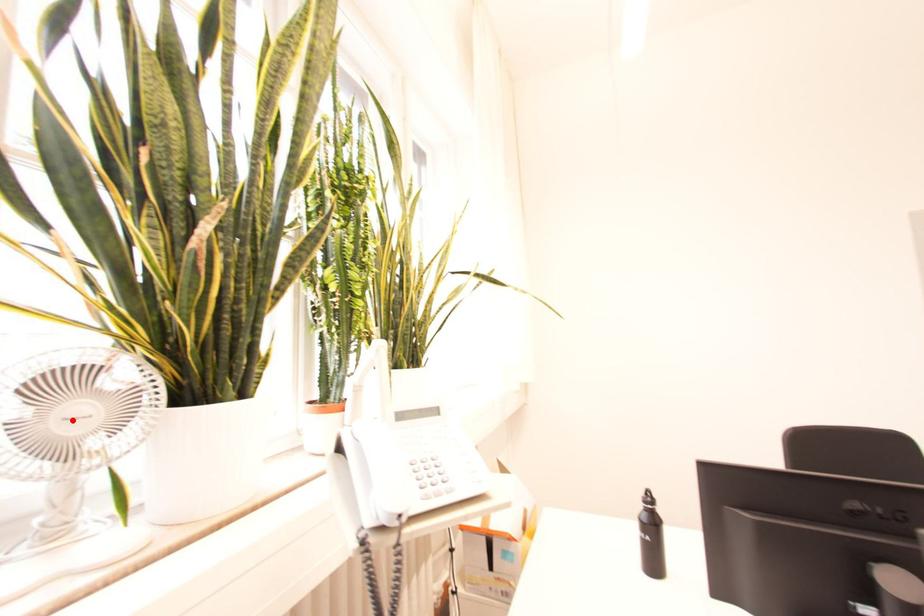
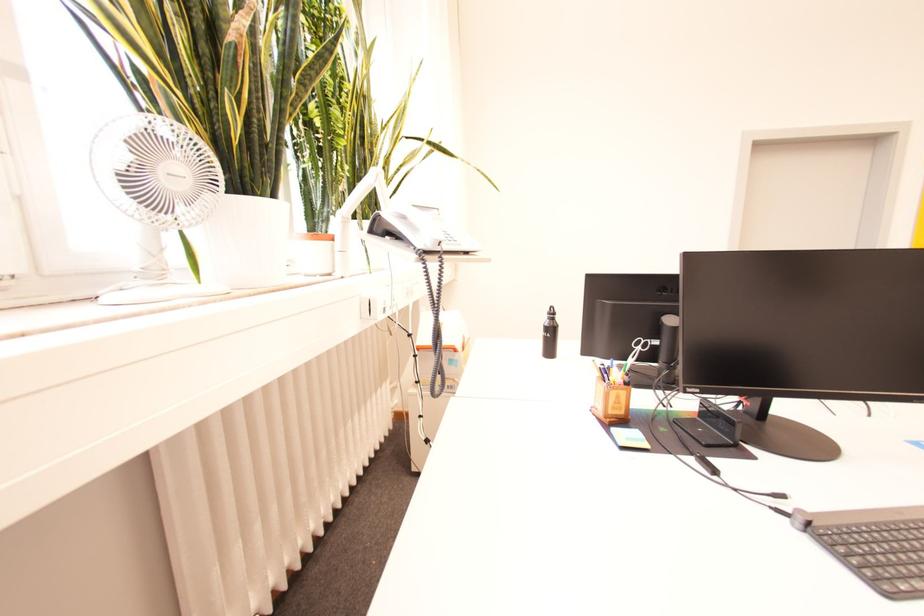
Locate, in the second image, the point that corresponds to the highlighted location in the first image.

(176, 176)